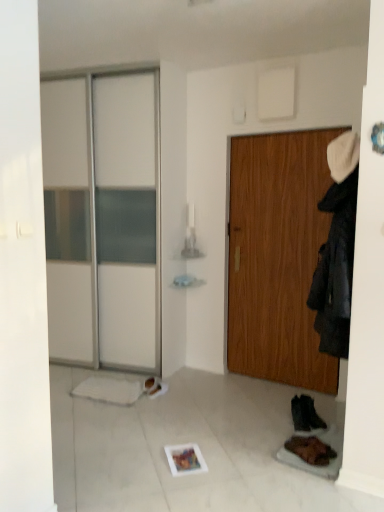
Question: Considering the relative sizes of wooden door at center and brown leather boot at lower right, the first footwear viewed from the front, in the image provided, is wooden door at center wider than brown leather boot at lower right, the first footwear viewed from the front,?

Choices:
 (A) yes
 (B) no

Answer: (B)

Question: Is wooden door at center aimed at brown leather boot at lower right, the first footwear viewed from the front?

Choices:
 (A) yes
 (B) no

Answer: (A)

Question: Is wooden door at center taller than brown leather boot at lower right, the first footwear viewed from the front?

Choices:
 (A) yes
 (B) no

Answer: (A)

Question: From a real-world perspective, is wooden door at center beneath brown leather boot at lower right, the first footwear viewed from the front?

Choices:
 (A) yes
 (B) no

Answer: (B)

Question: Does wooden door at center have a larger size compared to brown leather boot at lower right, the 2th footwear in the back-to-front sequence?

Choices:
 (A) yes
 (B) no

Answer: (A)

Question: From a real-world perspective, is dark gray fabric coat at right physically located above or below black suede boot at lower right, positioned as the first footwear in back-to-front order?

Choices:
 (A) below
 (B) above

Answer: (B)

Question: In terms of width, does dark gray fabric coat at right look wider or thinner when compared to black suede boot at lower right, positioned as the first footwear in back-to-front order?

Choices:
 (A) thin
 (B) wide

Answer: (B)

Question: From the image's perspective, is dark gray fabric coat at right above or below black suede boot at lower right, arranged as the 2th footwear when viewed from the front?

Choices:
 (A) below
 (B) above

Answer: (B)

Question: In the image, is dark gray fabric coat at right on the left side or the right side of black suede boot at lower right, positioned as the first footwear in back-to-front order?

Choices:
 (A) left
 (B) right

Answer: (A)

Question: In terms of width, does wooden door at center look wider or thinner when compared to brown leather boot at lower right, the 2th footwear in the back-to-front sequence?

Choices:
 (A) wide
 (B) thin

Answer: (B)

Question: Do you think wooden door at center is within brown leather boot at lower right, the first footwear viewed from the front, or outside of it?

Choices:
 (A) inside
 (B) outside

Answer: (B)

Question: From their relative heights in the image, would you say wooden door at center is taller or shorter than brown leather boot at lower right, the first footwear viewed from the front?

Choices:
 (A) short
 (B) tall

Answer: (B)

Question: Relative to brown leather boot at lower right, the 2th footwear in the back-to-front sequence, is wooden door at center in front or behind?

Choices:
 (A) front
 (B) behind

Answer: (B)

Question: Is wooden door at center wider or thinner than black suede boot at lower right, arranged as the 2th footwear when viewed from the front?

Choices:
 (A) thin
 (B) wide

Answer: (A)

Question: From the image's perspective, is wooden door at center above or below black suede boot at lower right, positioned as the first footwear in back-to-front order?

Choices:
 (A) below
 (B) above

Answer: (B)